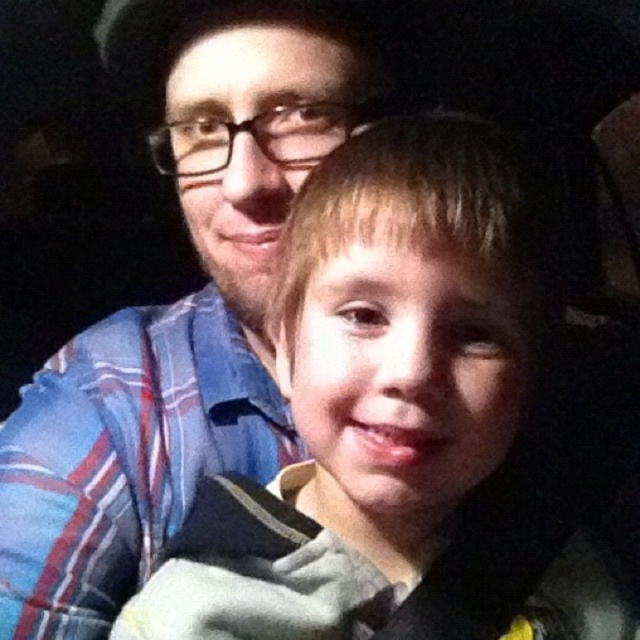
Can you confirm if smooth tan skin at center is positioned to the right of blue plaid shirt at upper left?

Indeed, smooth tan skin at center is positioned on the right side of blue plaid shirt at upper left.

Describe the element at coordinates (408, 420) in the screenshot. Image resolution: width=640 pixels, height=640 pixels. I see `smooth tan skin at center` at that location.

Measure the distance between smooth tan skin at center and camera.

They are 13.48 inches apart.

Find the location of `smooth tan skin at center`. smooth tan skin at center is located at coordinates (408, 420).